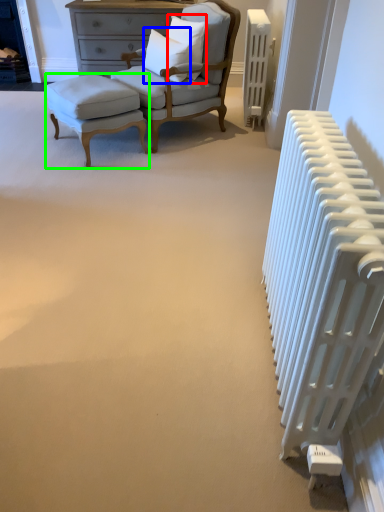
Question: Based on their relative distances, which object is nearer to pillow (highlighted by a red box)? Choose from pillow (highlighted by a blue box) and stool (highlighted by a green box).

Choices:
 (A) pillow
 (B) stool

Answer: (A)